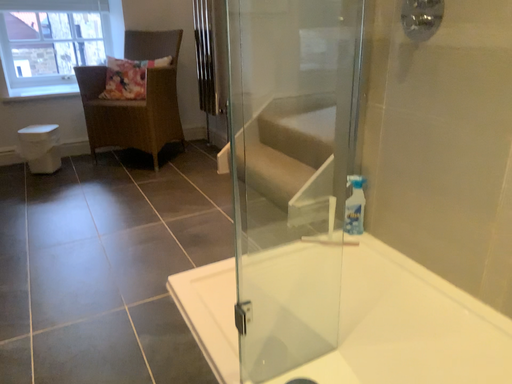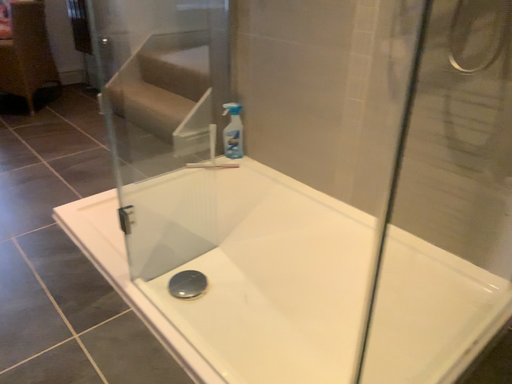
Question: How did the camera likely rotate when shooting the video?

Choices:
 (A) rotated right
 (B) rotated left

Answer: (A)